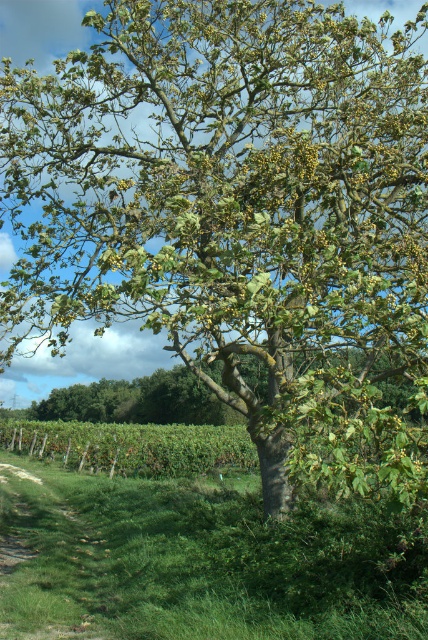
You are planning to take a walk in the rural landscape described. You notice the grassy dirt path at lower left and the green leafy tree at center. Which of these two features occupies a larger area in the scene?

The green leafy tree at center occupies a larger area in the scene than the grassy dirt path at lower left.

You are planning to plant a new tree in your backyard. You have a spot where there is a grassy dirt path at lower left and a green leafy tree at center. Which area would be better for planting the new tree based on their heights?

The green leafy tree at center is taller than the grassy dirt path at lower left, so planting the new tree near the green leafy tree at center would be better as it indicates sufficient space for growth.